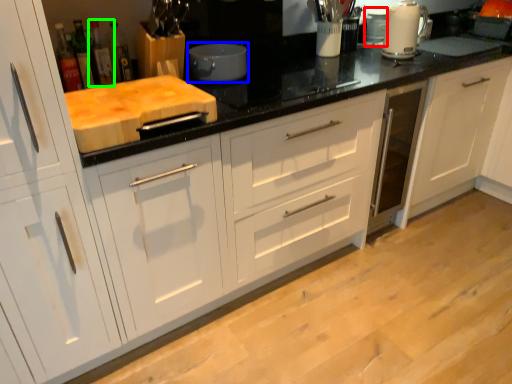
Question: Estimate the real-world distances between objects in this image. Which object is closer to appliance (highlighted by a red box), kitchen appliance (highlighted by a blue box) or bottle (highlighted by a green box)?

Choices:
 (A) kitchen appliance
 (B) bottle

Answer: (A)